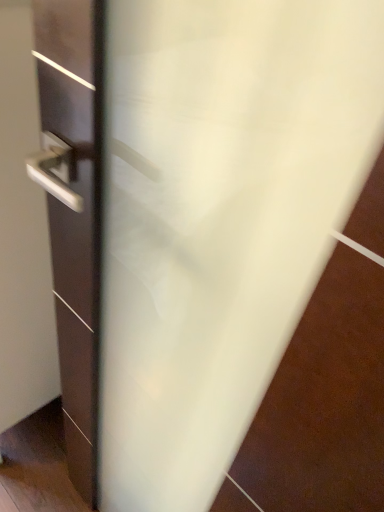
From the picture: What is the approximate width of white glossy screen door at left?

14.02 inches.

The image size is (384, 512). Describe the element at coordinates (74, 210) in the screenshot. I see `white glossy screen door at left` at that location.

What are the coordinates of `white glossy screen door at left` in the screenshot? It's located at (74, 210).

The height and width of the screenshot is (512, 384). I want to click on white glossy screen door at left, so click(74, 210).